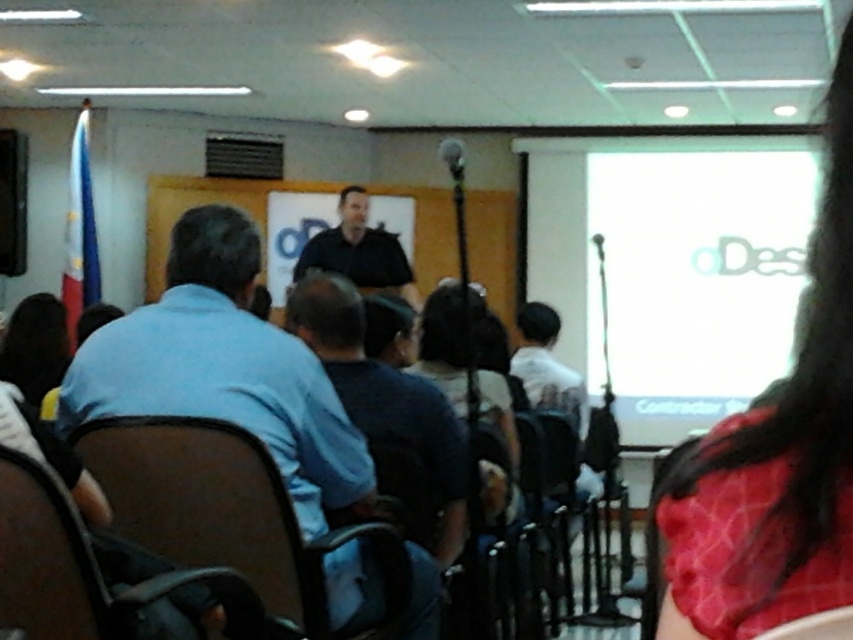
Is dark blue shirt at center closer to the viewer compared to brown leather chair at lower left?

No, it is behind brown leather chair at lower left.

In the scene shown: Is dark blue shirt at center thinner than brown leather chair at lower left?

Incorrect, dark blue shirt at center's width is not less than brown leather chair at lower left's.

Identify the location of dark blue shirt at center. The image size is (853, 640). (386, 397).

Is white matte projection screen at upper right taller than matte black chair at center?

Yes, white matte projection screen at upper right is taller than matte black chair at center.

Who is more forward, (654, 356) or (833, 630)?

Point (833, 630)

Who is more forward, (695, 369) or (846, 621)?

Point (846, 621)

Identify the location of white matte projection screen at upper right. The width and height of the screenshot is (853, 640). (672, 266).

Is the position of red satin hair at upper right more distant than that of brown leather chair at center?

No, it is in front of brown leather chair at center.

Measure the distance from red satin hair at upper right to brown leather chair at center.

The distance of red satin hair at upper right from brown leather chair at center is 4.50 feet.

Where is `red satin hair at upper right`? red satin hair at upper right is located at coordinates (776, 452).